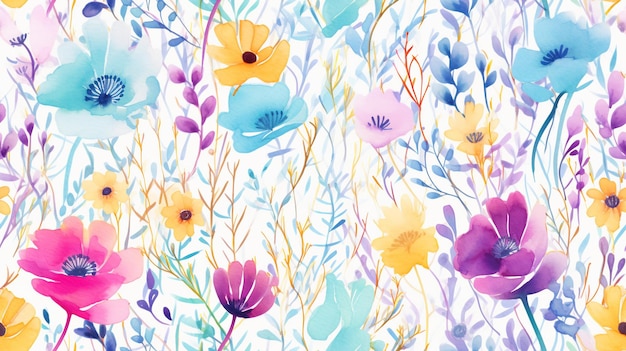
In order to click on flower on the top right in this screenshot , I will do (556, 69).